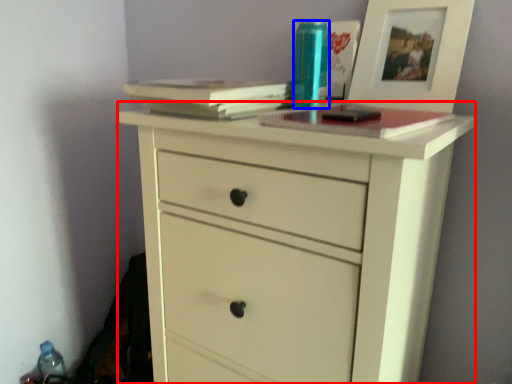
Question: Which object appears closest to the camera in this image, chest of drawers (highlighted by a red box) or bottle (highlighted by a blue box)?

Choices:
 (A) chest of drawers
 (B) bottle

Answer: (A)